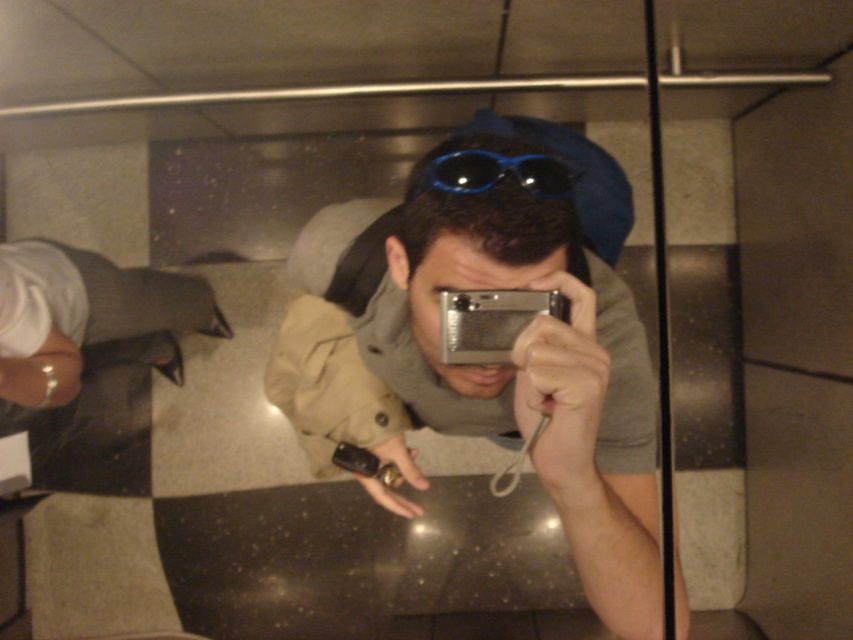
Is silver metallic camera at center below blue plastic goggles at center?

Yes.

Identify the location of silver metallic camera at center. (486, 365).

What are the coordinates of `silver metallic camera at center` in the screenshot? It's located at (486, 365).